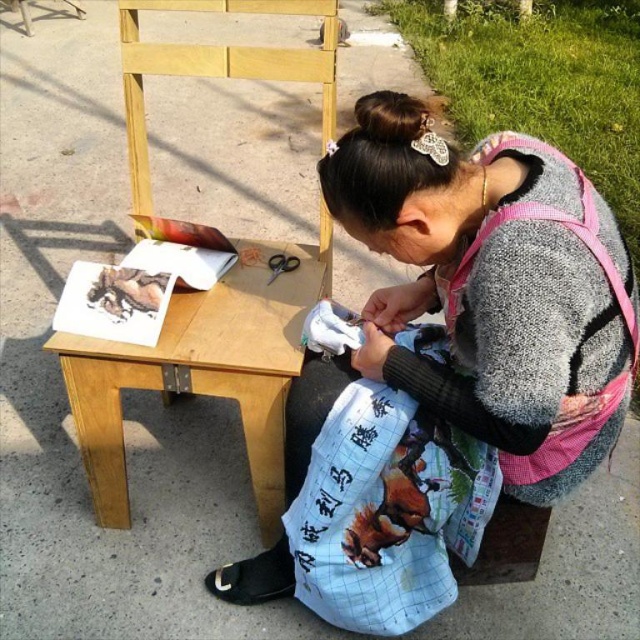
Question: Can you confirm if white fabric bag at center is positioned to the right of printed fabric tote bag at lower center?

Choices:
 (A) yes
 (B) no

Answer: (A)

Question: Does white fabric bag at center lie behind printed fabric tote bag at lower center?

Choices:
 (A) yes
 (B) no

Answer: (B)

Question: Which point is farther to the camera?

Choices:
 (A) click(x=563, y=394)
 (B) click(x=244, y=429)

Answer: (B)

Question: Among these points, which one is nearest to the camera?

Choices:
 (A) pos(448,499)
 (B) pos(193,314)
 (C) pos(547,454)

Answer: (C)

Question: Is white fabric bag at center further to camera compared to printed fabric tote bag at lower center?

Choices:
 (A) no
 (B) yes

Answer: (A)

Question: Which point is farther from the camera taking this photo?

Choices:
 (A) (202, 298)
 (B) (449, 547)

Answer: (A)